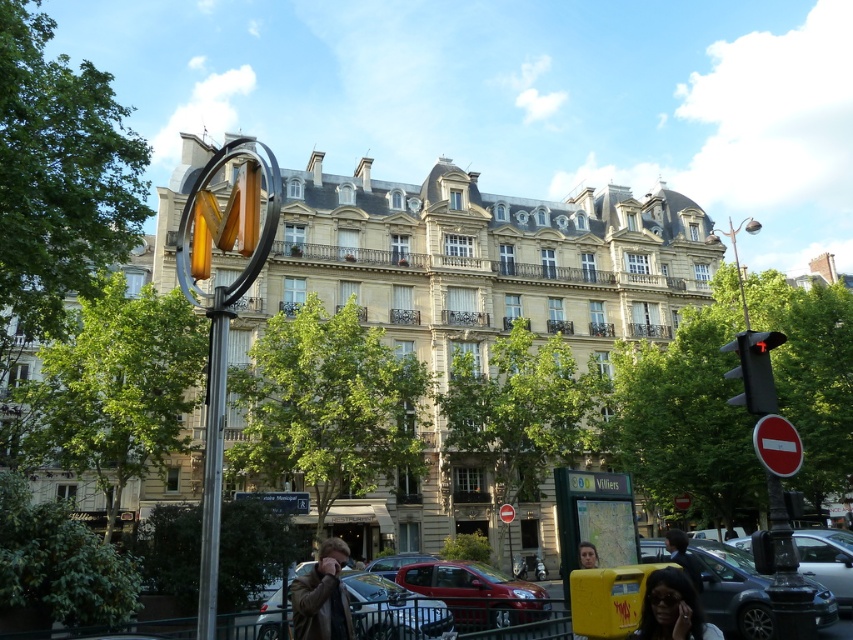
You are standing at the metro station entrance and want to take a photo of the ornate building. You notice two points marked in the scene. Which of the two points, point [277,500] or point [421,561], is closer to your camera lens when capturing the building?

Point [277,500] is closer to the camera than point [421,561], so it will appear nearer in the photo.

You are a pedestrian waiting at the crosswalk with the red Do Not Walk signal. You see a metallic red car at center and a matte black hair at lower center. Which object is closer to your right side?

The matte black hair at lower center is closer to your right side because the metallic red car at center is to the left of it.

You are a pedestrian standing at the crosswalk with the red Do Not Walk signal. You need to reach the metallic rectangular sign at lower center before the matte red car at center arrives. The car is approaching at 10 km per hour. Can you make it?

The metallic rectangular sign at lower center is 8.71 meters away from the matte red car at center. Since the car is moving at 10 km per hour, it will take approximately 3 seconds to reach the sign. Pedestrians typically need at least 5 seconds to cross safely, so you should wait until the walk signal appears before proceeding.